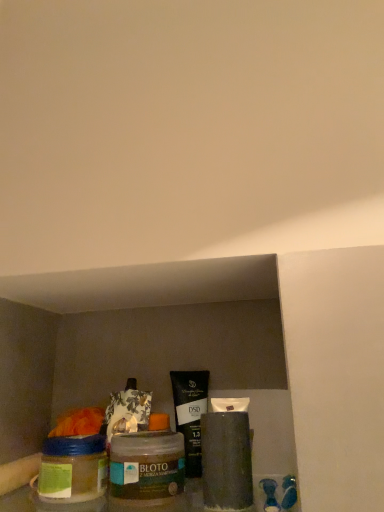
Question: Does black matte tube at center have a lesser width compared to matte black tube at center?

Choices:
 (A) yes
 (B) no

Answer: (A)

Question: Is black matte tube at center far from matte black tube at center?

Choices:
 (A) no
 (B) yes

Answer: (A)

Question: Does black matte tube at center lie in front of matte black tube at center?

Choices:
 (A) yes
 (B) no

Answer: (B)

Question: Could matte black tube at center be considered to be inside black matte tube at center?

Choices:
 (A) yes
 (B) no

Answer: (B)

Question: From a real-world perspective, is black matte tube at center beneath matte black tube at center?

Choices:
 (A) no
 (B) yes

Answer: (A)

Question: Considering their positions, is matte black tube at center located in front of or behind black matte tube at center?

Choices:
 (A) front
 (B) behind

Answer: (A)

Question: Considering the positions of matte black tube at center and black matte tube at center in the image, is matte black tube at center wider or thinner than black matte tube at center?

Choices:
 (A) thin
 (B) wide

Answer: (B)

Question: In terms of size, does matte black tube at center appear bigger or smaller than black matte tube at center?

Choices:
 (A) big
 (B) small

Answer: (A)

Question: Is point (228, 407) positioned closer to the camera than point (178, 418)?

Choices:
 (A) farther
 (B) closer

Answer: (B)

Question: In terms of height, does black matte tube at center look taller or shorter compared to matte black tube at center?

Choices:
 (A) short
 (B) tall

Answer: (B)

Question: Is black matte tube at center wider or thinner than matte black tube at center?

Choices:
 (A) wide
 (B) thin

Answer: (B)

Question: From a real-world perspective, is black matte tube at center positioned above or below matte black tube at center?

Choices:
 (A) above
 (B) below

Answer: (A)

Question: Is point (196, 414) positioned closer to the camera than point (228, 488)?

Choices:
 (A) farther
 (B) closer

Answer: (A)

Question: Is matte black tube at center spatially inside translucent glass jar at lower left, or outside of it?

Choices:
 (A) outside
 (B) inside

Answer: (A)

Question: From the image's perspective, is matte black tube at center above or below translucent glass jar at lower left?

Choices:
 (A) below
 (B) above

Answer: (B)